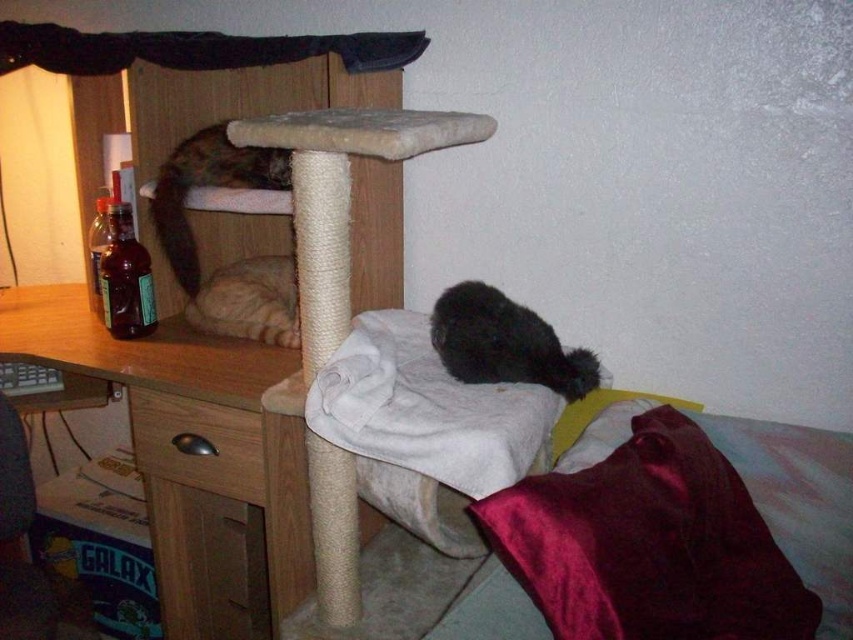
Who is shorter, black fuzzy cat at center or tabby fur cat at upper left?

black fuzzy cat at center is shorter.

Is black fuzzy cat at center further to the viewer compared to tabby fur cat at upper left?

No.

Does point (450, 310) come in front of point (248, 180)?

Yes, point (450, 310) is in front of point (248, 180).

In order to click on black fuzzy cat at center in this screenshot , I will do `click(505, 342)`.

Who is lower down, beige carpeted cat tree at center or tabby fur cat at upper left?

beige carpeted cat tree at center is below.

Which is more to the right, beige carpeted cat tree at center or tabby fur cat at upper left?

From the viewer's perspective, beige carpeted cat tree at center appears more on the right side.

Does point (234, 125) lie behind point (228, 150)?

That is False.

The width and height of the screenshot is (853, 640). Identify the location of beige carpeted cat tree at center. (341, 195).

Can you confirm if beige carpeted cat tree at center is bigger than wooden drawer at lower left?

Correct, beige carpeted cat tree at center is larger in size than wooden drawer at lower left.

This screenshot has width=853, height=640. What do you see at coordinates (341, 195) in the screenshot? I see `beige carpeted cat tree at center` at bounding box center [341, 195].

Find the location of a particular element. beige carpeted cat tree at center is located at coordinates (341, 195).